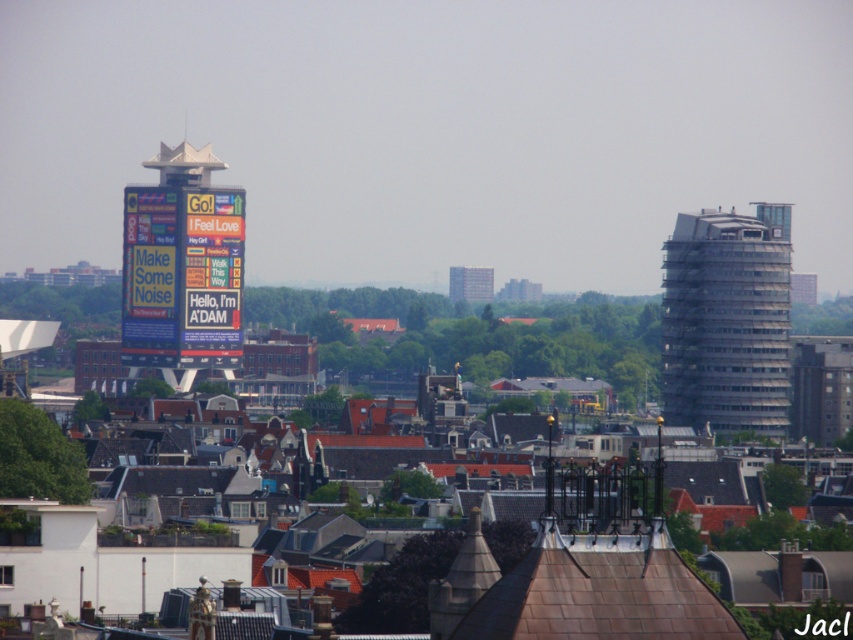
You are a city planner evaluating the skyline of Amsterdam. You need to determine if the slate gray glass building at right will block the view of the gray concrete building at center from the main square. Based on their heights, what do you conclude?

The slate gray glass building at right is taller than the gray concrete building at center, so it will block the view of the gray concrete building at center from the main square.

You are a drone operator trying to capture a photo of the slate gray glass building at right and the multicolored digital billboard at center. From your current position above the city, which object should you point your camera at first to ensure both are in frame?

The slate gray glass building at right is below the multicolored digital billboard at center, so you should point your camera at the multicolored digital billboard at center first to ensure both are in frame.